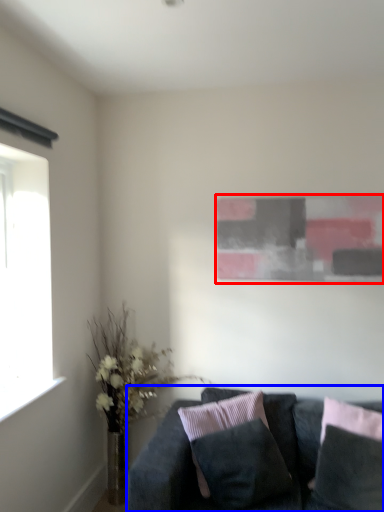
Question: Which of the following is the closest to the observer, picture frame (highlighted by a red box) or studio couch (highlighted by a blue box)?

Choices:
 (A) picture frame
 (B) studio couch

Answer: (B)